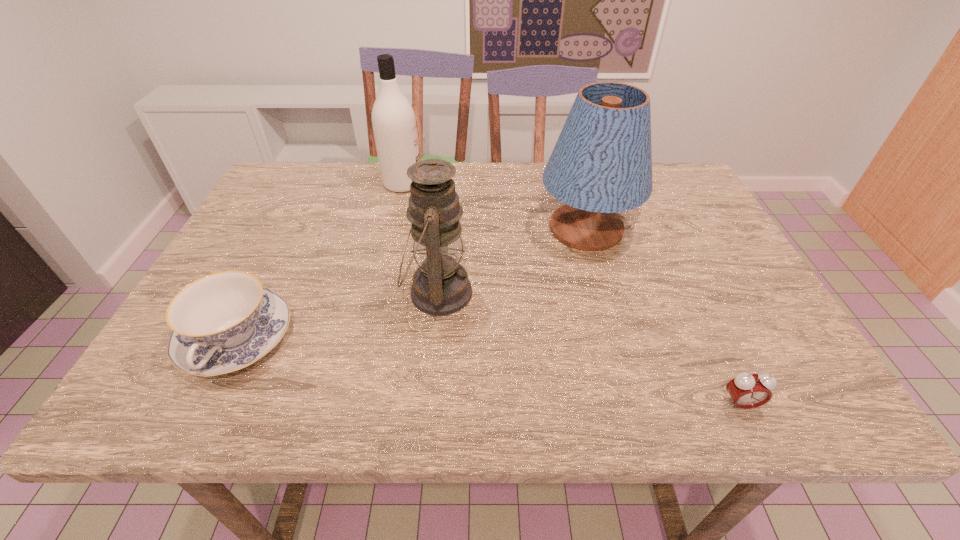
Identify the location of free region at the right edge of the desktop. This screenshot has height=540, width=960. (730, 251).

You are a GUI agent. You are given a task and a screenshot of the screen. Output one action in this format:
    pyautogui.click(x=<x>, y=<y>)
    Task: Click on the vacant area at the near left corner of the desktop
    
    Given the screenshot: What is the action you would take?
    pyautogui.click(x=167, y=374)

Locate an element on the screen. blank region between the chinaware and the alarm clock is located at coordinates (488, 372).

Where is `vacant point located between the leftmost object and the lampshade`? This screenshot has height=540, width=960. vacant point located between the leftmost object and the lampshade is located at coordinates click(412, 284).

The height and width of the screenshot is (540, 960). Identify the location of vacant area that lies between the shampoo and the chinaware. (320, 262).

The width and height of the screenshot is (960, 540). What are the coordinates of `blank region between the oil lamp and the chinaware` in the screenshot? It's located at (337, 316).

Where is `blank region between the alarm clock and the farthest object`? The image size is (960, 540). blank region between the alarm clock and the farthest object is located at coordinates (571, 294).

In order to click on vacant space that is in between the oil lamp and the lampshade in this screenshot , I will do `click(513, 261)`.

Where is `vacant region between the shampoo and the rightmost object`? The height and width of the screenshot is (540, 960). vacant region between the shampoo and the rightmost object is located at coordinates (571, 294).

You are a GUI agent. You are given a task and a screenshot of the screen. Output one action in this format:
    pyautogui.click(x=<x>, y=<y>)
    Task: Click on the blank region between the shortest object and the farthest object
    This screenshot has height=540, width=960.
    Given the screenshot: What is the action you would take?
    pyautogui.click(x=571, y=294)